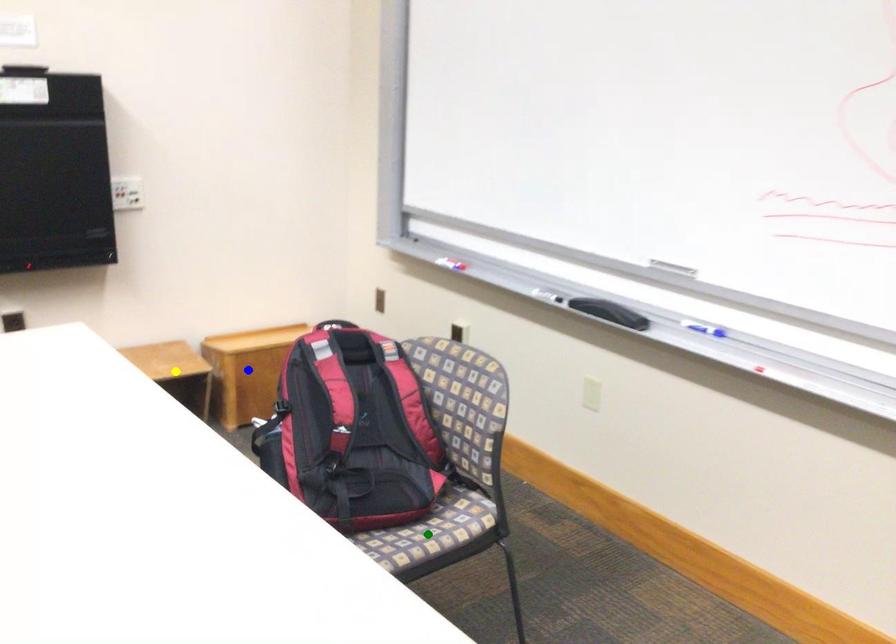
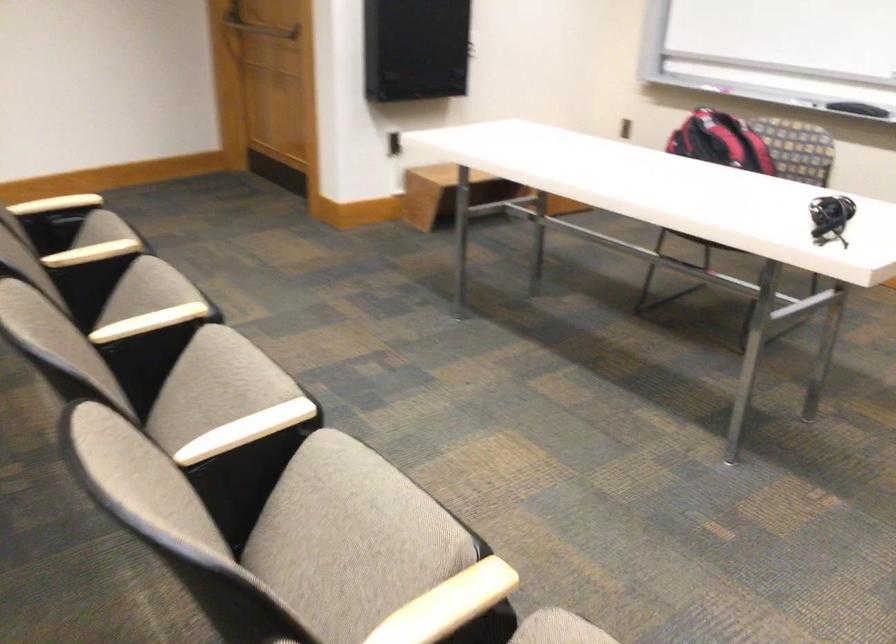
I am providing you with two images of the same scene from different viewpoints. Three points are marked in image1. Which point corresponds to a part or object that is occluded in image2?In image1, three points are marked. Which of them correspond to a part or object that is occluded in image2?Among the three points shown in image1, which one corresponds to a part or object that is no longer visible due to occlusion in image2?

Invisible in image2: yellow point, blue point, green point.